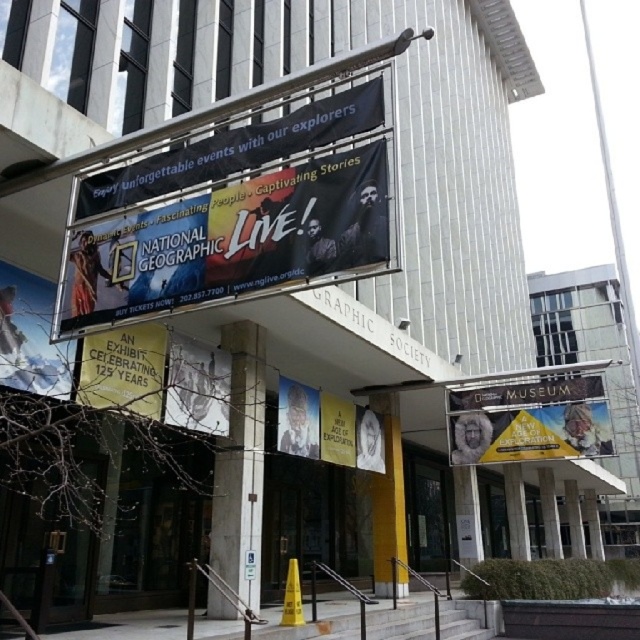
You are standing in front of the museum entrance and see the yellow fabric banner at center and the yellow paper at center. Which object is closer to you?

The yellow fabric banner at center is closer to you because it is further to the viewer than the yellow paper at center.

You are standing in front of the museum entrance and see the yellow paper at center. If you want to touch it, should you move your hand to the left or right side of the entrance?

The yellow paper at center is located at the center of the entrance, so you should move your hand to the center to touch it.